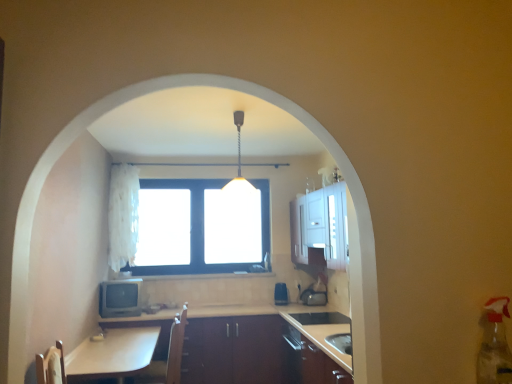
Question: Considering the relative sizes of brown leather swivel chair at lower left and matte gray television at lower left, which is the second appliance in back-to-front order, in the image provided, is brown leather swivel chair at lower left thinner than matte gray television at lower left, which is the second appliance in back-to-front order,?

Choices:
 (A) yes
 (B) no

Answer: (B)

Question: Is brown leather swivel chair at lower left aimed at matte gray television at lower left, placed as the first appliance when sorted from left to right?

Choices:
 (A) no
 (B) yes

Answer: (A)

Question: Considering the relative sizes of brown leather swivel chair at lower left and matte gray television at lower left, the 1th appliance positioned from the front, in the image provided, is brown leather swivel chair at lower left smaller than matte gray television at lower left, the 1th appliance positioned from the front,?

Choices:
 (A) yes
 (B) no

Answer: (B)

Question: Is brown leather swivel chair at lower left wider than matte gray television at lower left, the 1th appliance positioned from the front?

Choices:
 (A) yes
 (B) no

Answer: (A)

Question: From the image's perspective, is brown leather swivel chair at lower left located beneath matte gray television at lower left, which is the second appliance in back-to-front order?

Choices:
 (A) no
 (B) yes

Answer: (B)

Question: In the image, is matte gray television at lower left, placed as the first appliance when sorted from left to right, on the left side or the right side of brown leather swivel chair at lower left?

Choices:
 (A) right
 (B) left

Answer: (B)

Question: From the image's perspective, is matte gray television at lower left, placed as the first appliance when sorted from left to right, positioned above or below brown leather swivel chair at lower left?

Choices:
 (A) above
 (B) below

Answer: (A)

Question: Which is correct: matte gray television at lower left, the 1th appliance positioned from the front, is inside brown leather swivel chair at lower left, or outside of it?

Choices:
 (A) inside
 (B) outside

Answer: (B)

Question: Is matte gray television at lower left, which is the second appliance in back-to-front order, bigger or smaller than brown leather swivel chair at lower left?

Choices:
 (A) small
 (B) big

Answer: (A)

Question: Is clear glass window at center bigger or smaller than metallic pendant light at center?

Choices:
 (A) small
 (B) big

Answer: (B)

Question: From the image's perspective, relative to metallic pendant light at center, is clear glass window at center above or below?

Choices:
 (A) below
 (B) above

Answer: (A)

Question: Relative to metallic pendant light at center, is clear glass window at center in front or behind?

Choices:
 (A) behind
 (B) front

Answer: (A)

Question: Is point (157, 185) positioned closer to the camera than point (251, 193)?

Choices:
 (A) closer
 (B) farther

Answer: (B)

Question: From a real-world perspective, is white glossy table at lower left physically located above or below brown leather swivel chair at lower left?

Choices:
 (A) below
 (B) above

Answer: (A)

Question: Is white glossy table at lower left wider or thinner than brown leather swivel chair at lower left?

Choices:
 (A) thin
 (B) wide

Answer: (B)